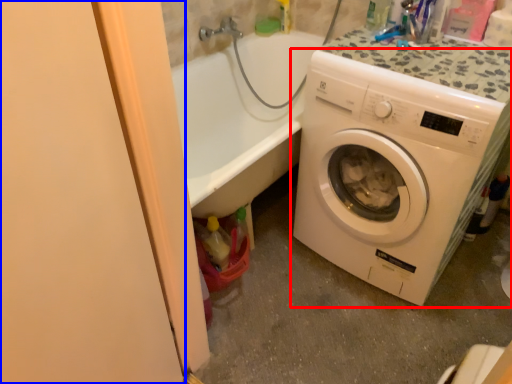
Question: Which of the following is the farthest to the observer, washing machine (highlighted by a red box) or screen door (highlighted by a blue box)?

Choices:
 (A) washing machine
 (B) screen door

Answer: (A)